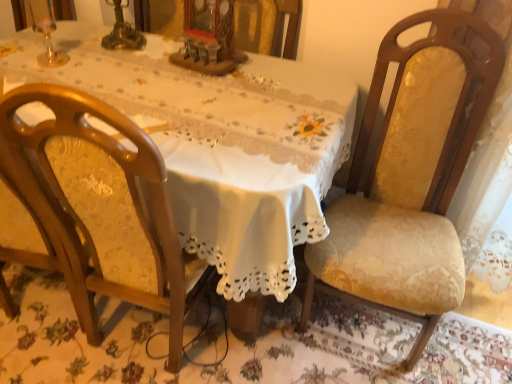
Question: Visually, is velvet yellow chair at right, the second chair from the left, positioned to the left or to the right of white lace tablecloth at center?

Choices:
 (A) left
 (B) right

Answer: (B)

Question: Is velvet yellow chair at right, marked as the 1th chair in a right-to-left arrangement, bigger or smaller than white lace tablecloth at center?

Choices:
 (A) small
 (B) big

Answer: (A)

Question: Considering the real-world distances, which object is farthest from the velvet yellow chair at right, the second chair from the left?

Choices:
 (A) white lace tablecloth at center
 (B) wooden chair at left, acting as the 1th chair starting from the left

Answer: (B)

Question: Based on their relative distances, which object is farther from the velvet yellow chair at right, the second chair from the left?

Choices:
 (A) wooden chair at left, which ranks as the 2th chair in right-to-left order
 (B) white lace tablecloth at center

Answer: (A)